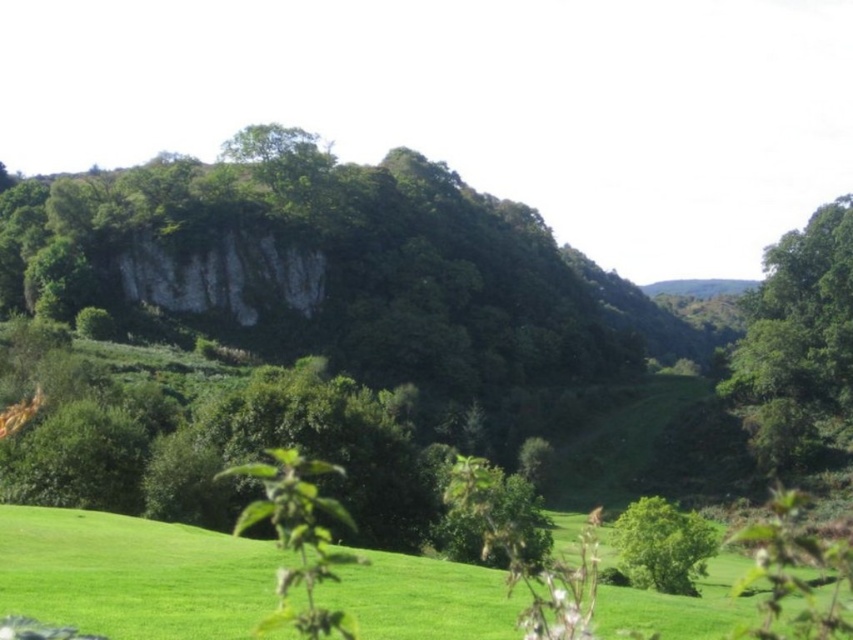
Question: Is green leafy tree at upper right positioned behind green leafy tree at center?

Choices:
 (A) no
 (B) yes

Answer: (B)

Question: Does green leafy tree at upper right appear on the right side of green leafy tree at center?

Choices:
 (A) no
 (B) yes

Answer: (B)

Question: Among these objects, which one is nearest to the camera?

Choices:
 (A) green grassy field at lower center
 (B) green leafy tree at center
 (C) green leafy tree at upper right

Answer: (A)

Question: Among these points, which one is farthest from the camera?

Choices:
 (A) (788, 461)
 (B) (691, 595)
 (C) (405, 628)

Answer: (A)

Question: Estimate the real-world distances between objects in this image. Which object is closer to the green grassy field at lower center?

Choices:
 (A) green leafy tree at upper right
 (B) green leafy tree at center

Answer: (B)

Question: Is green grassy field at lower center to the left of green leafy tree at upper right from the viewer's perspective?

Choices:
 (A) yes
 (B) no

Answer: (A)